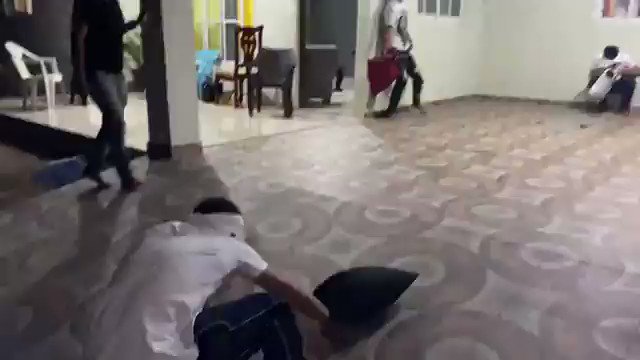
The width and height of the screenshot is (640, 360). In order to click on carpet in this screenshot , I will do `click(540, 161)`.